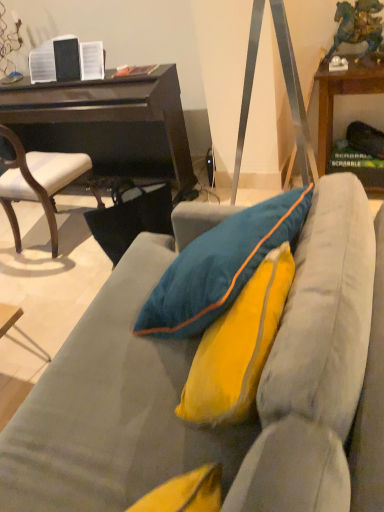
The image size is (384, 512). What do you see at coordinates (185, 381) in the screenshot?
I see `suede gray couch at center` at bounding box center [185, 381].

Image resolution: width=384 pixels, height=512 pixels. Find the location of `suede gray couch at center`. suede gray couch at center is located at coordinates (185, 381).

Measure the distance between point (79, 395) and camera.

A distance of 1.17 meters exists between point (79, 395) and camera.

What are the coordinates of `suede gray couch at center` in the screenshot? It's located at (185, 381).